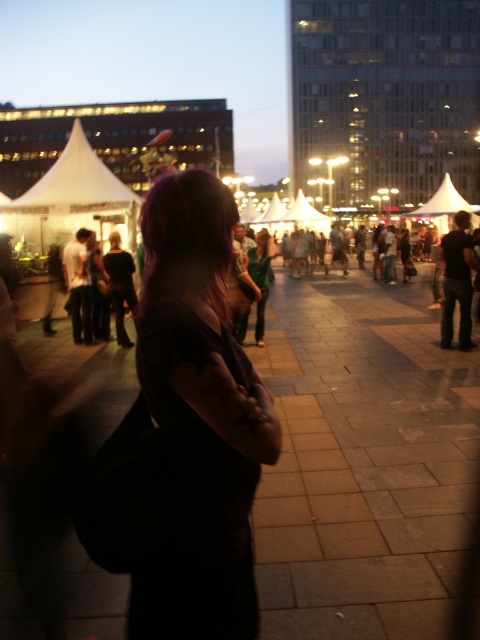
You are a photographer trying to capture a photo of the matte black dress at center and the white fabric canopy at upper left in the same frame. The camera you are using has a maximum focal length that allows capturing objects up to 12 meters apart. Will you be able to include both objects in a single photo without moving the camera?

The matte black dress at center and the white fabric canopy at upper left are 12.17 meters apart from each other. Since the camera can only capture objects up to 12 meters apart, the distance between them exceeds the camera capability. Therefore, you cannot include both in a single photo without moving the camera.

You are a photographer trying to capture the crowd around the white tents in the midground. There is a matte black dress at center located at point (200, 416). Will this dress be in the foreground or midground of your photo?

The matte black dress at center located at point (200, 416) is in the midground since it is positioned at the point specified, which aligns with the midground description of the scene.

You are a photographer trying to capture a clear shot of the matte black dress at center and the white fabric canopy at upper left. Since you want both subjects in focus, which one should you focus on first to ensure depth of field?

The matte black dress at center is closer to the viewer than the white fabric canopy at upper left. To ensure both are in focus, you should focus on the matte black dress at center first, as focusing on the closer subject allows the depth of field to extend backward, covering the farther object.